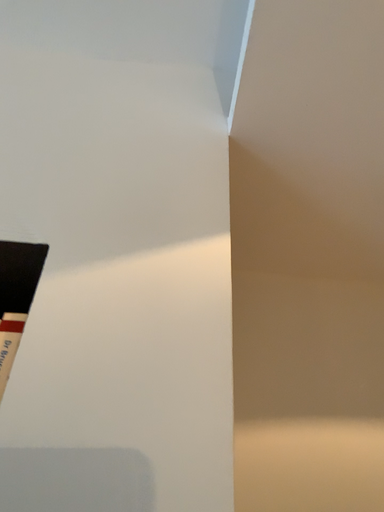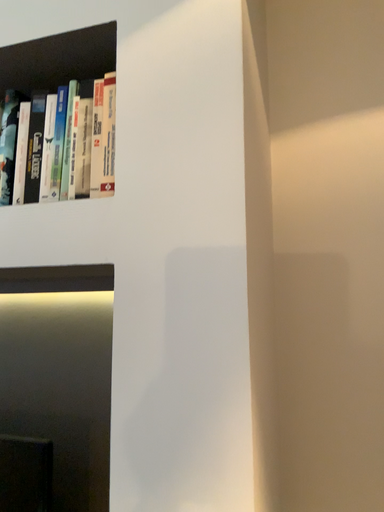
Question: Which way did the camera rotate in the video?

Choices:
 (A) rotated left
 (B) rotated right

Answer: (A)